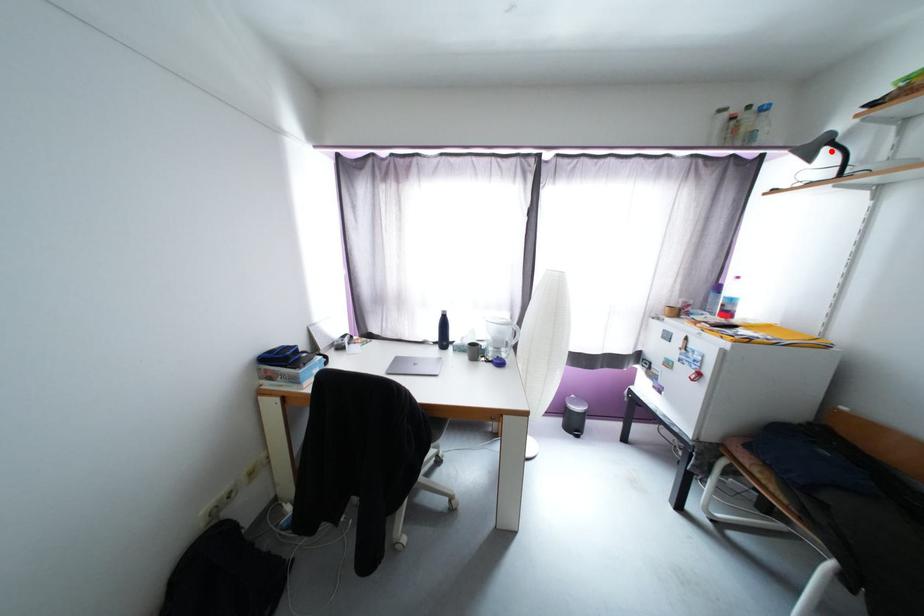
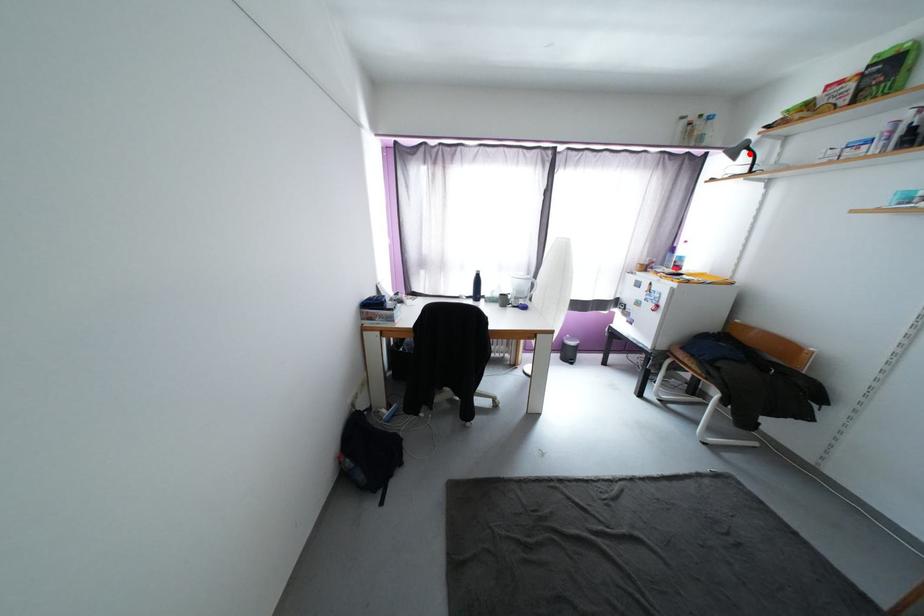
I am providing you with two images of the same scene from different viewpoints. A red point is marked on the first image and another point is marked on the second image. Do the highlighted points in image1 and image2 indicate the same real-world spot?

Yes